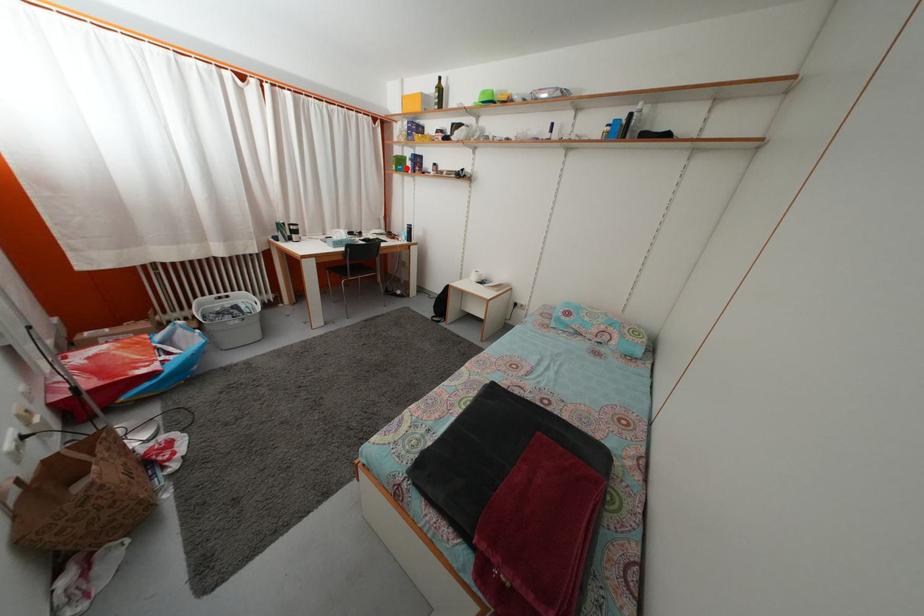
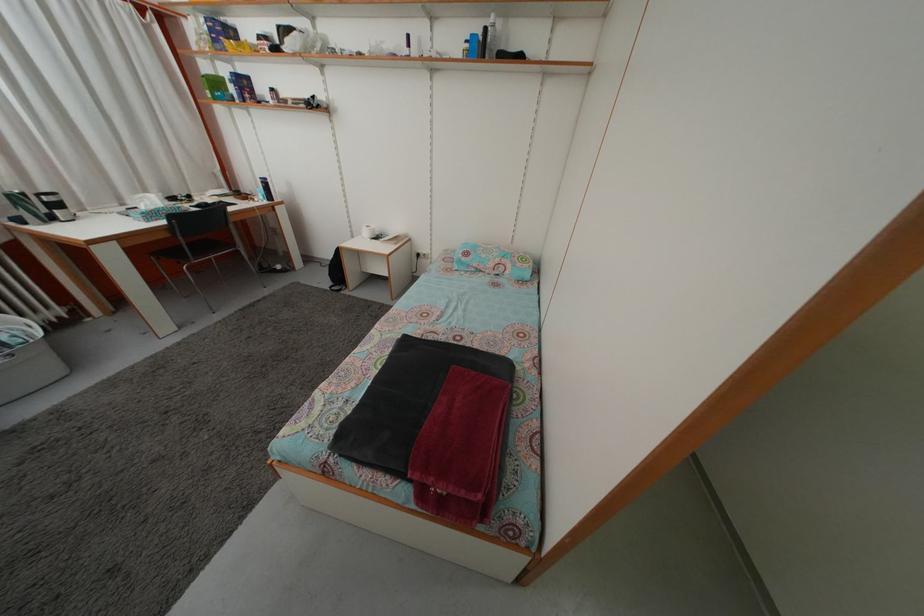
Question: A red point is marked in image1. In image2, is the corresponding 3D point closer to the camera or farther? Reply with the corresponding letter.

Choices:
 (A) The corresponding 3D point is closer.
 (B) The corresponding 3D point is farther.

Answer: (B)